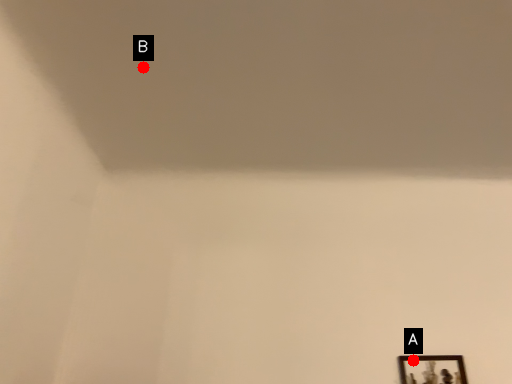
Question: Two points are circled on the image, labeled by A and B beside each circle. Which point is farther to the camera?

Choices:
 (A) A is further
 (B) B is further

Answer: (A)